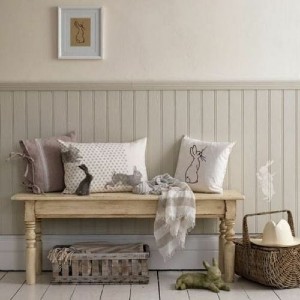
Where is `stuffed dark gray bunny`? This screenshot has height=300, width=300. stuffed dark gray bunny is located at coordinates (85, 187).